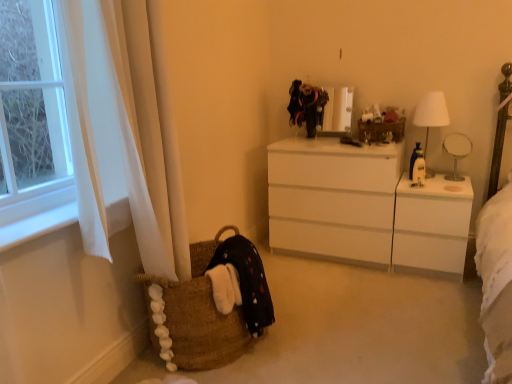
Image resolution: width=512 pixels, height=384 pixels. Identify the location of vacant area on top of white fabric at left (from a real-world perspective). click(44, 220).